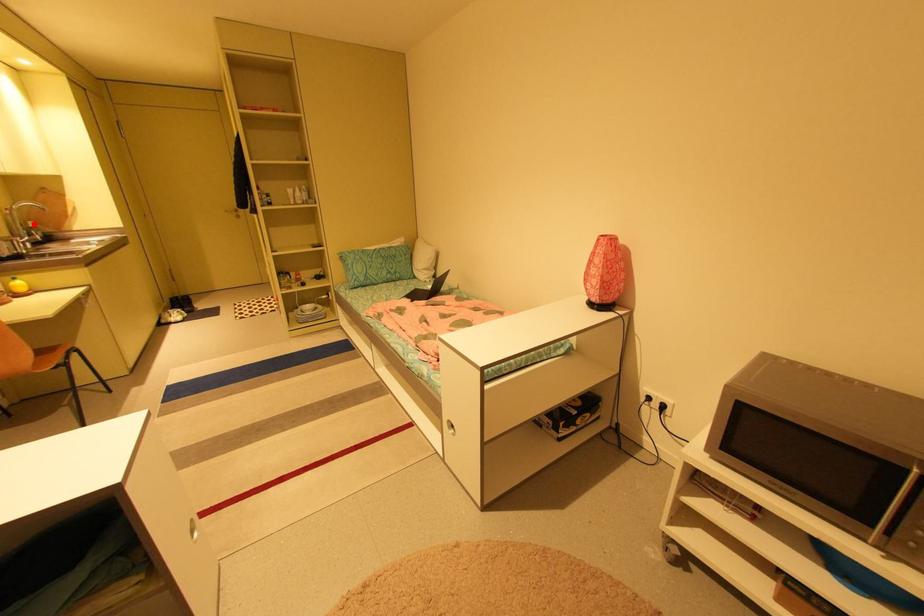
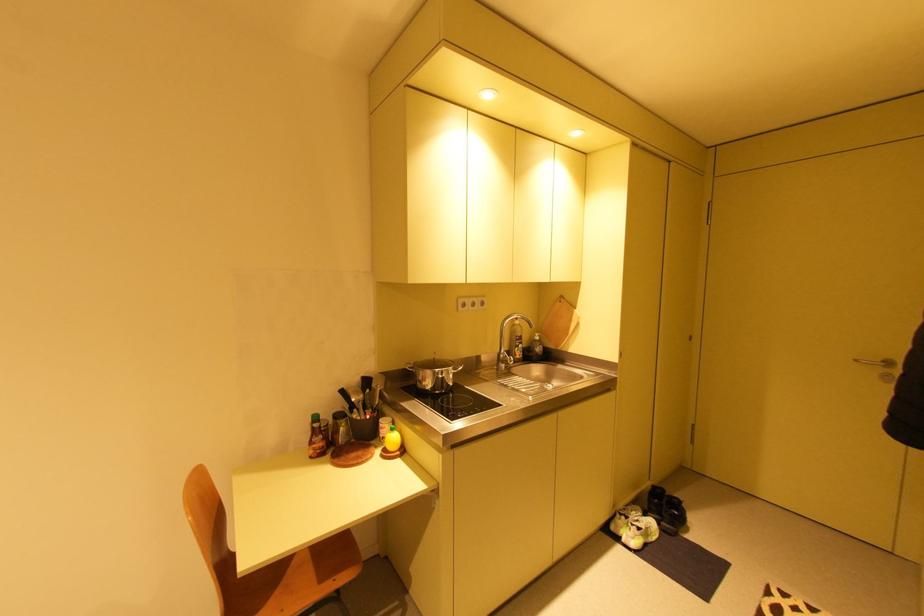
In the second image, find the point that corresponds to the highlighted location in the first image.

(541, 336)